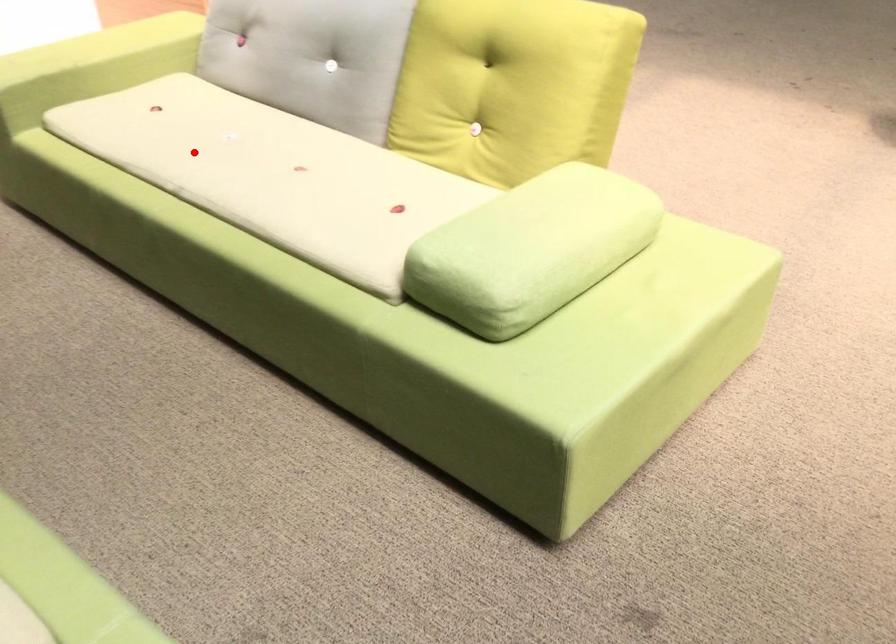
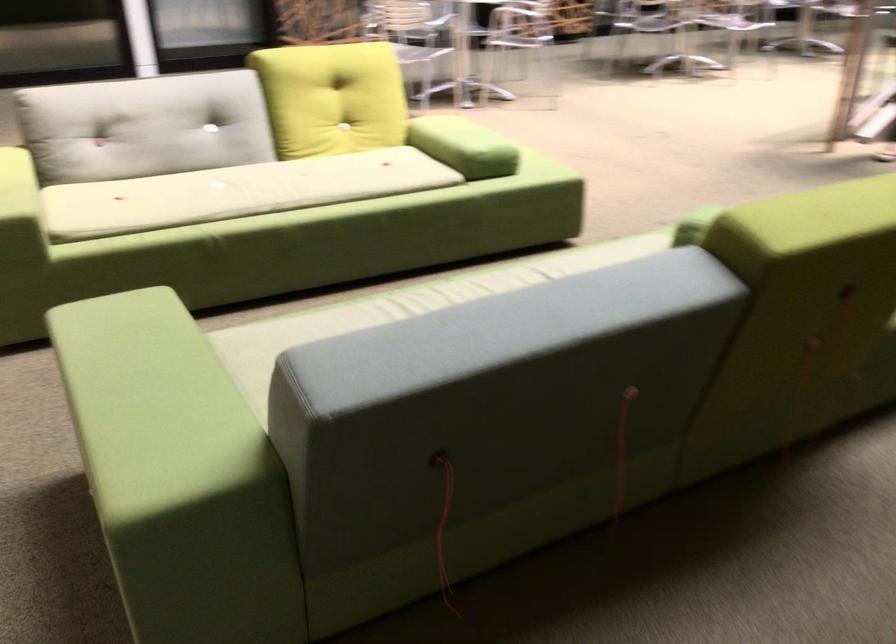
Question: I am providing you with two images of the same scene from different viewpoints. Image1 has a red point marked. In image2, the corresponding 3D location appears at what relative position? Reply with the corresponding letter.

Choices:
 (A) Closer
 (B) Farther

Answer: (B)